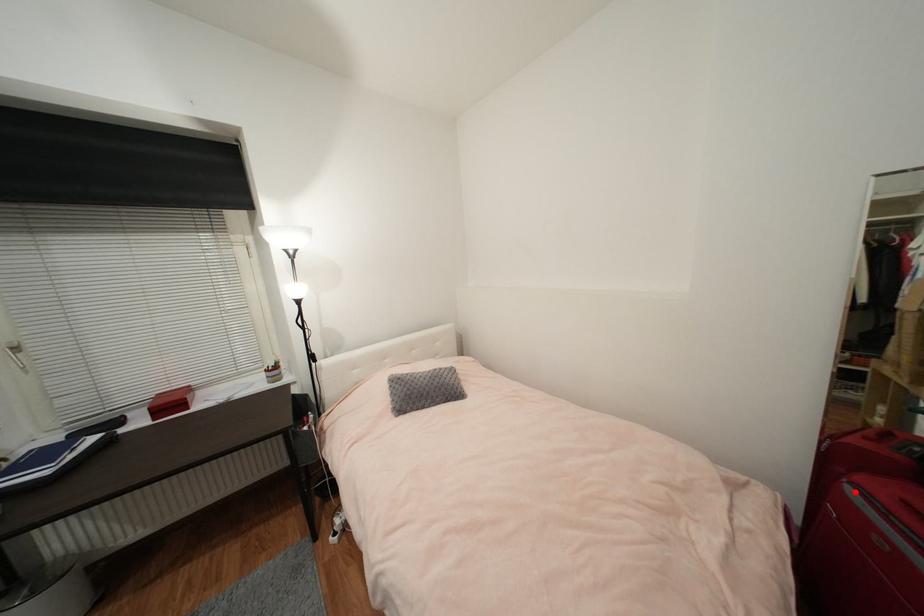
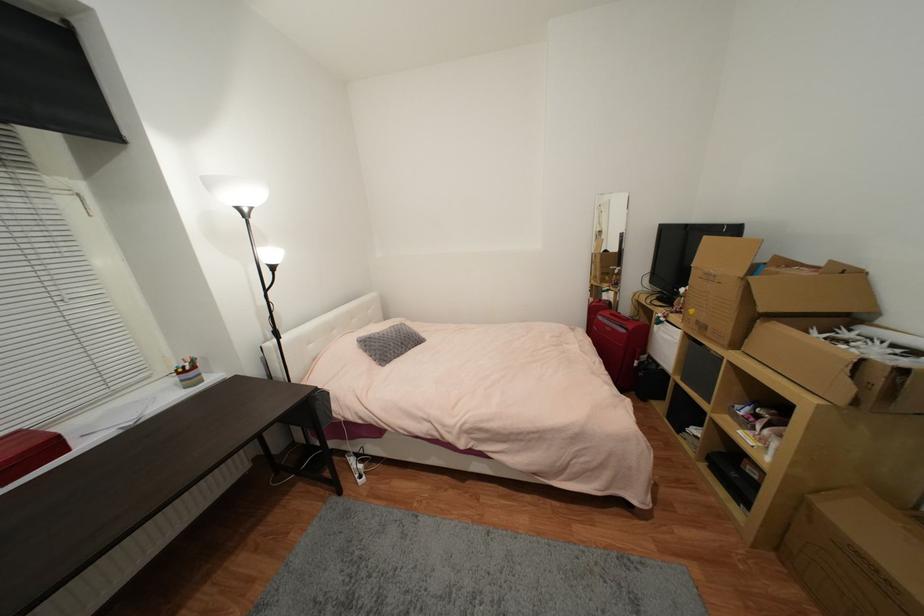
In the second image, find the point that corresponds to the highlighted location in the first image.

(603, 318)